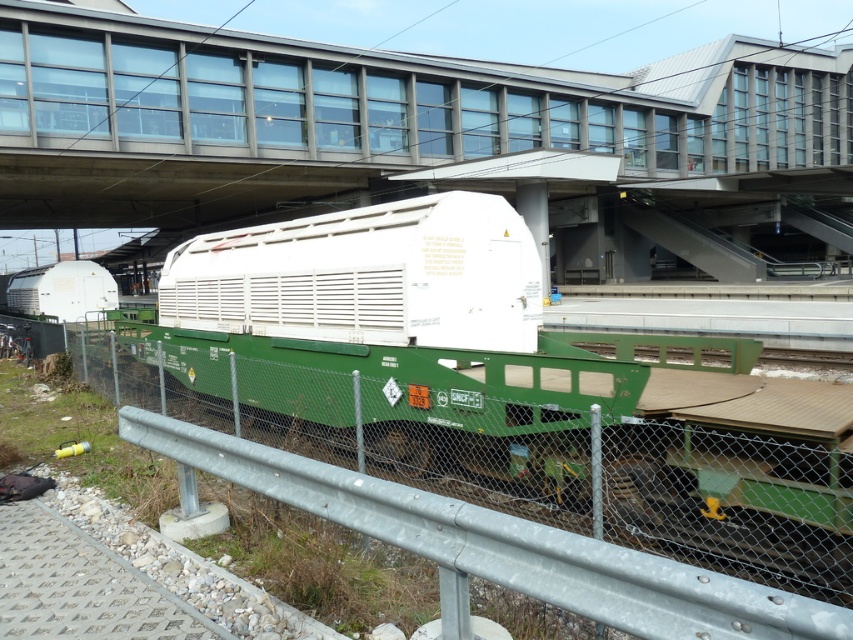
Looking at this image, does white matte container at center have a larger size compared to metal at center?

Yes.

Who is lower down, white matte container at center or metal at center?

metal at center

At what (x,y) coordinates should I click in order to perform the action: click on white matte container at center. Please return your answer as a coordinate pair (x, y). Looking at the image, I should click on (421, 140).

At what (x,y) coordinates should I click in order to perform the action: click on white matte container at center. Please return your answer as a coordinate pair (x, y). The width and height of the screenshot is (853, 640). Looking at the image, I should click on (421, 140).